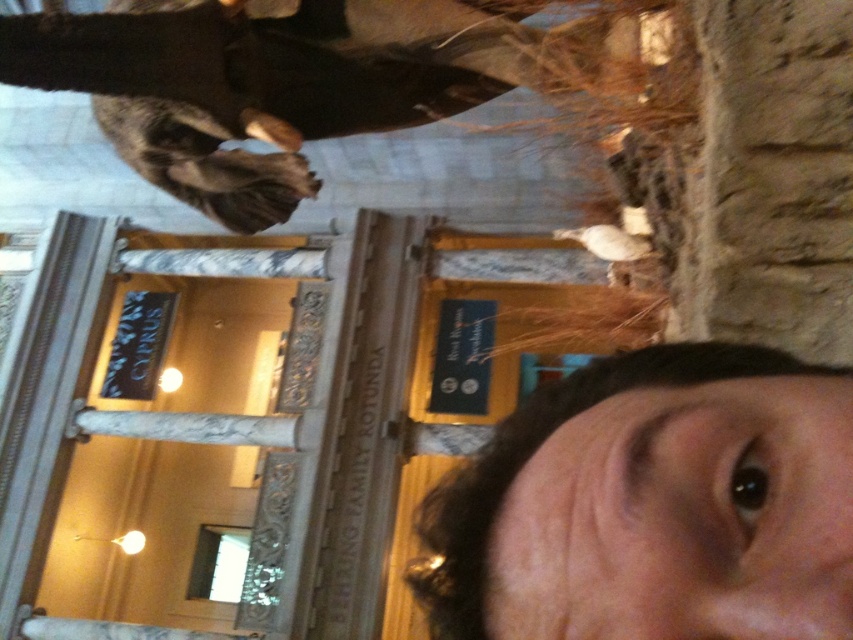
Is smooth skin face at lower right further to the viewer compared to shiny black coat at upper center?

No, smooth skin face at lower right is closer to the viewer.

Which is more to the right, smooth skin face at lower right or shiny black coat at upper center?

From the viewer's perspective, smooth skin face at lower right appears more on the right side.

What do you see at coordinates (653, 506) in the screenshot? This screenshot has width=853, height=640. I see `smooth skin face at lower right` at bounding box center [653, 506].

Find the location of a particular element. This screenshot has height=640, width=853. smooth skin face at lower right is located at coordinates (653, 506).